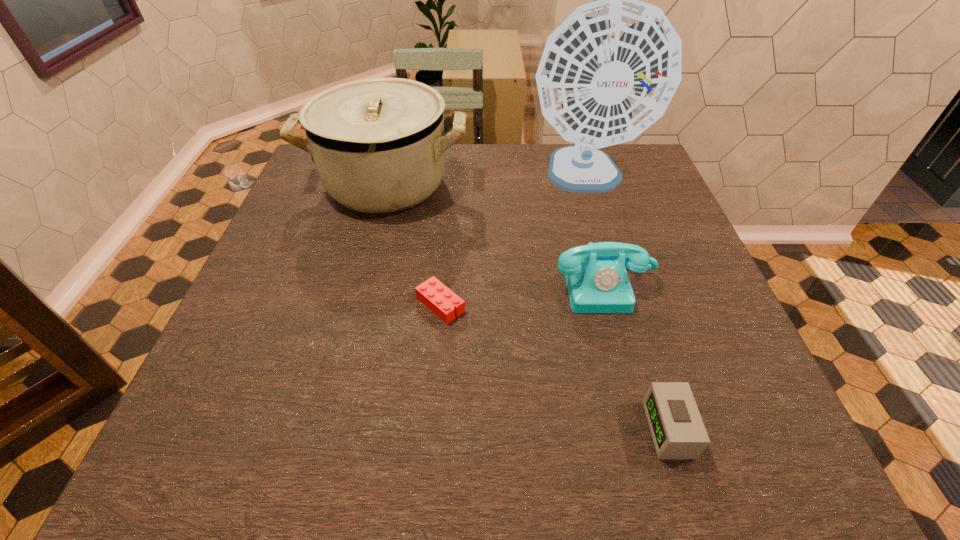
In order to click on object present at the far left corner in this screenshot , I will do `click(378, 144)`.

Find the location of `object that is at the far right corner`. object that is at the far right corner is located at coordinates (609, 71).

I want to click on object located in the near right corner section of the desktop, so click(x=678, y=432).

The height and width of the screenshot is (540, 960). What are the coordinates of `vacant space at the far edge of the desktop` in the screenshot? It's located at (511, 155).

Identify the location of free space at the near edge. The image size is (960, 540). (279, 424).

Where is `vacant space at the left edge of the desktop`? Image resolution: width=960 pixels, height=540 pixels. vacant space at the left edge of the desktop is located at coordinates (321, 211).

Where is `free space at the right edge of the desktop`? The image size is (960, 540). free space at the right edge of the desktop is located at coordinates [x=642, y=196].

I want to click on vacant space at the near right corner, so click(x=725, y=429).

At what (x,y) coordinates should I click in order to perform the action: click on empty space that is in between the third tallest object and the nearest object. Please return your answer as a coordinate pair (x, y). The width and height of the screenshot is (960, 540). Looking at the image, I should click on (636, 357).

Where is `vacant space that's between the nearest object and the telephone`? The width and height of the screenshot is (960, 540). vacant space that's between the nearest object and the telephone is located at coordinates (636, 357).